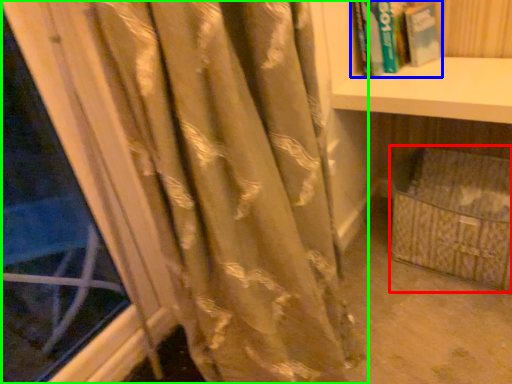
Question: Which object is the closest to the basket (highlighted by a red box)? Choose among these: book (highlighted by a blue box) or curtain (highlighted by a green box).

Choices:
 (A) book
 (B) curtain

Answer: (A)